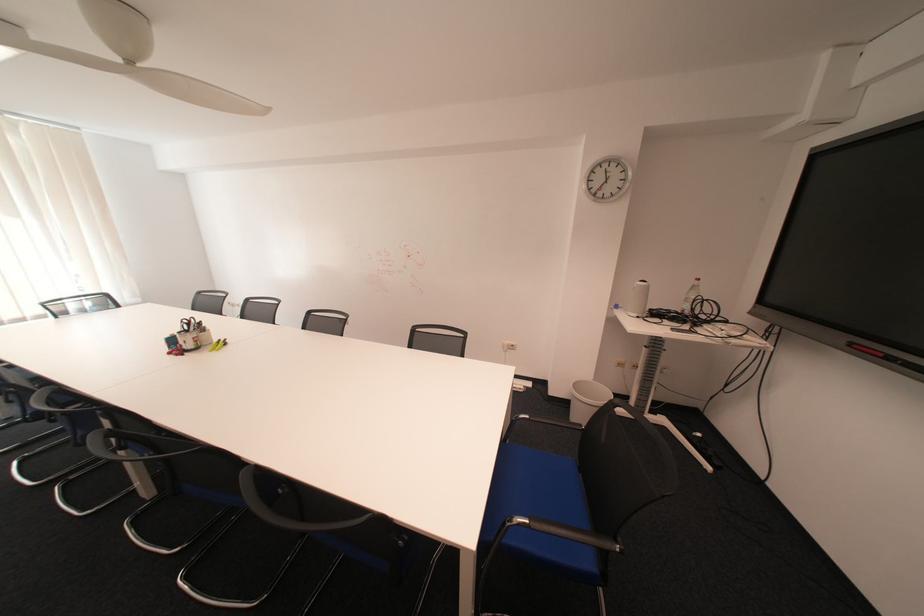
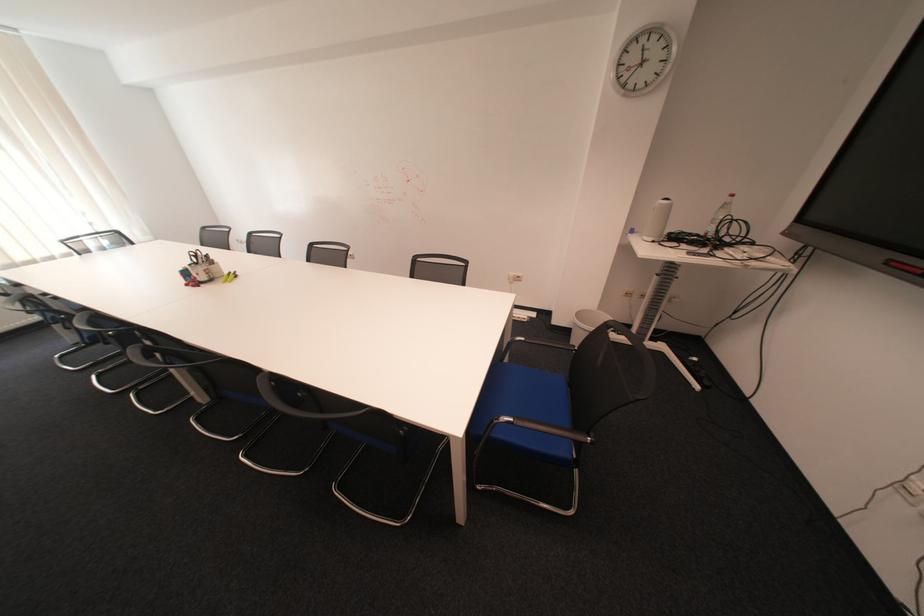
Locate, in the second image, the point that corresponds to the point at 517,524 in the first image.

(504, 422)